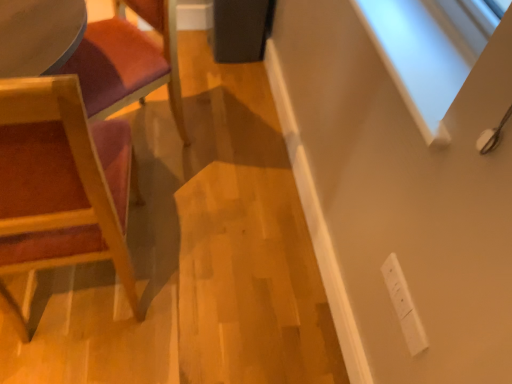
The image size is (512, 384). What are the coordinates of `vacant space to the right of wooden chair at left, marked as the 1th chair in a top-to-bottom arrangement` in the screenshot? It's located at (217, 158).